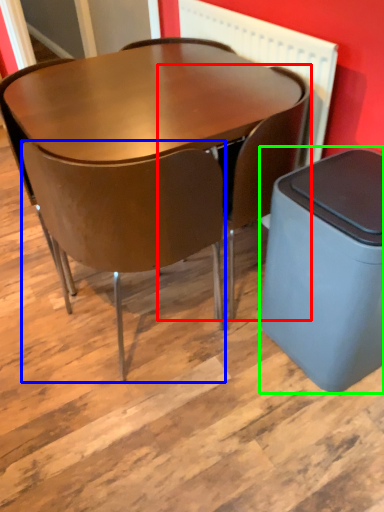
Question: Based on their relative distances, which object is nearer to chair (highlighted by a red box)? Choose from chair (highlighted by a blue box) and waste container (highlighted by a green box).

Choices:
 (A) chair
 (B) waste container

Answer: (B)